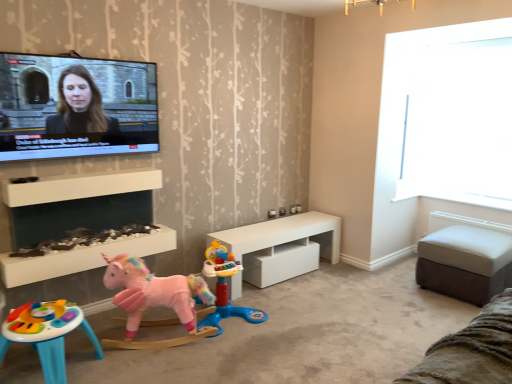
What are the coordinates of `free space to the right of white glossy table at center, which is the 1th table from left to right` in the screenshot? It's located at (370, 283).